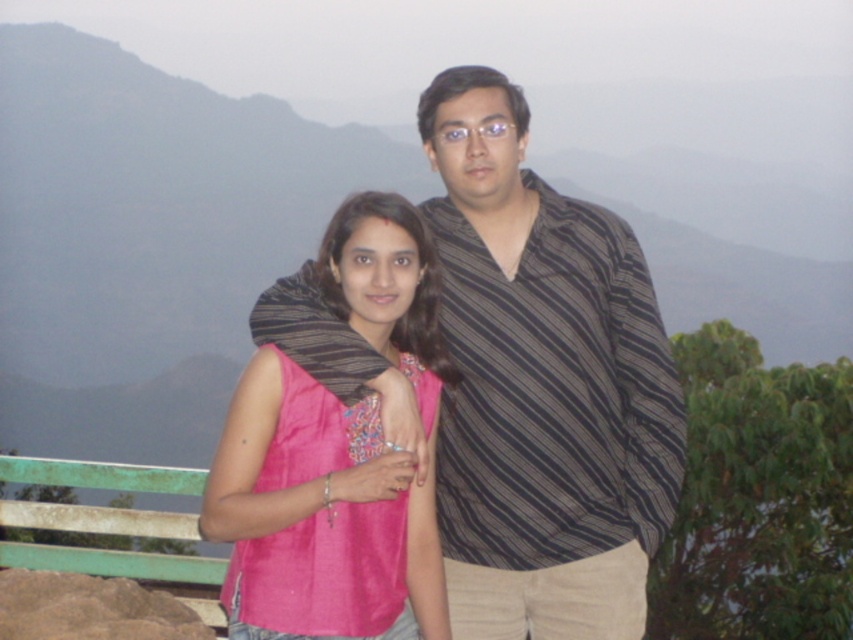
Can you confirm if striped fabric shirt at center is positioned to the right of pink fabric at center?

Yes, striped fabric shirt at center is to the right of pink fabric at center.

Between point (659, 412) and point (300, 380), which one is positioned in front?

Point (300, 380) is more forward.

This screenshot has width=853, height=640. Find the location of `striped fabric shirt at center`. striped fabric shirt at center is located at coordinates (543, 387).